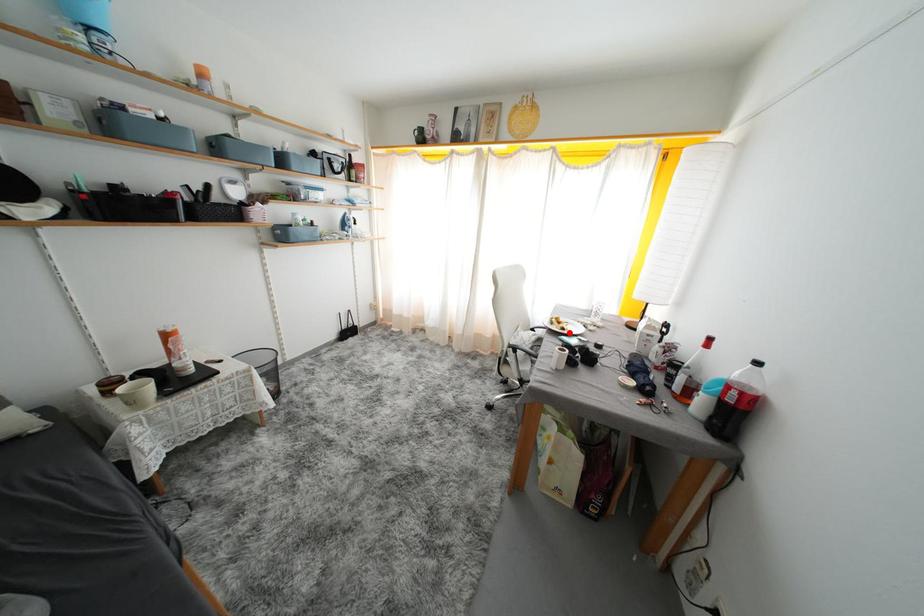
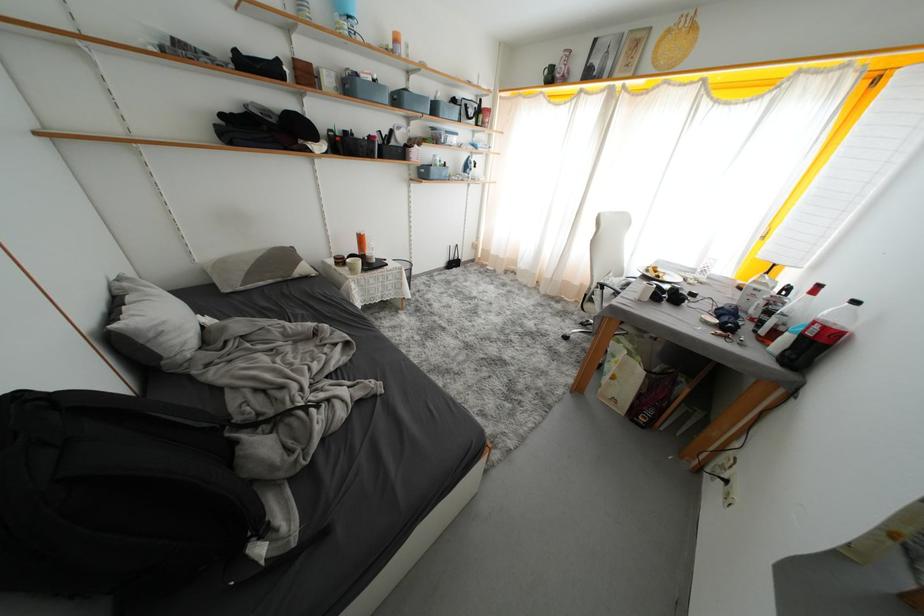
The point at the highlighted location is marked in the first image. Where is the corresponding point in the second image?

(664, 281)